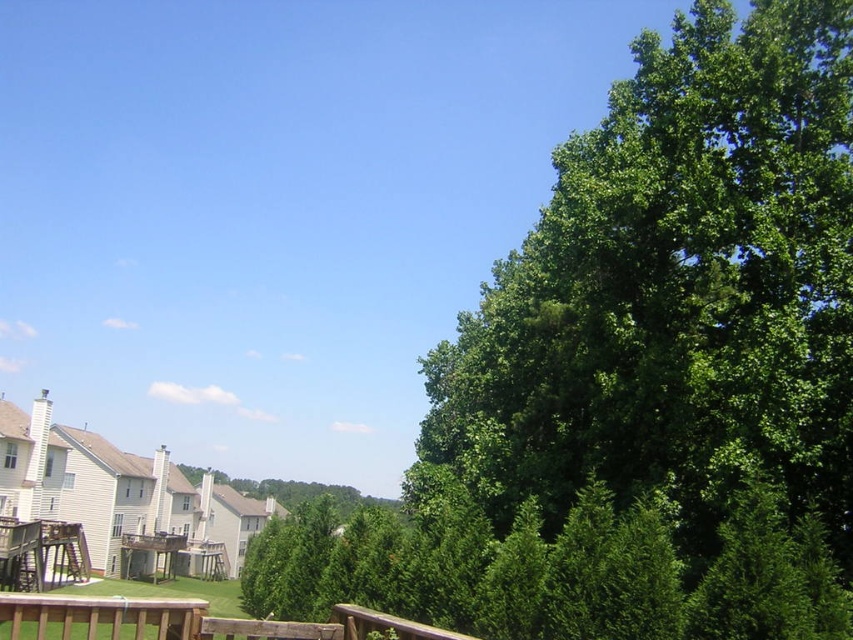
Question: Can you confirm if green leafy tree at upper right is positioned above brown wooden porch at lower left?

Choices:
 (A) yes
 (B) no

Answer: (B)

Question: Among these points, which one is farthest from the camera?

Choices:
 (A) (225, 627)
 (B) (624, 276)

Answer: (B)

Question: Where is green leafy tree at upper right located in relation to brown wooden porch at lower left in the image?

Choices:
 (A) below
 (B) above

Answer: (A)

Question: Among these points, which one is nearest to the camera?

Choices:
 (A) (787, 477)
 (B) (308, 625)

Answer: (B)

Question: Which point is farther from the camera taking this photo?

Choices:
 (A) (264, 627)
 (B) (775, 637)

Answer: (B)

Question: Is green leafy tree at upper right positioned at the back of brown wooden porch at lower left?

Choices:
 (A) no
 (B) yes

Answer: (B)